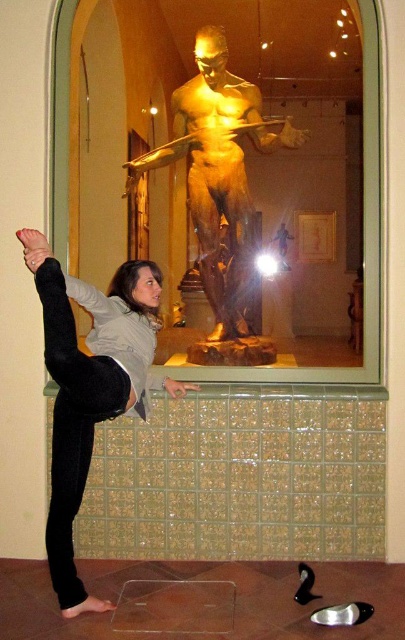
Question: Is matte black leggings at lower left positioned before gold polished statue at center?

Choices:
 (A) no
 (B) yes

Answer: (B)

Question: Which of the following is the farthest from the observer?

Choices:
 (A) gold polished statue at center
 (B) matte black leggings at lower left

Answer: (A)

Question: Is matte black leggings at lower left to the right of gold polished statue at center from the viewer's perspective?

Choices:
 (A) no
 (B) yes

Answer: (A)

Question: Considering the relative positions of matte black leggings at lower left and gold polished statue at center in the image provided, where is matte black leggings at lower left located with respect to gold polished statue at center?

Choices:
 (A) below
 (B) above

Answer: (A)